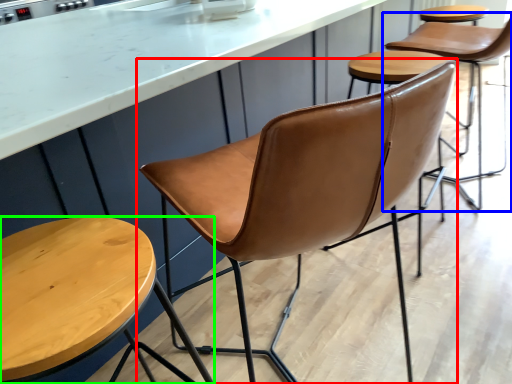
Question: Based on their relative distances, which object is nearer to chair (highlighted by a red box)? Choose from chair (highlighted by a blue box) and stool (highlighted by a green box).

Choices:
 (A) chair
 (B) stool

Answer: (B)